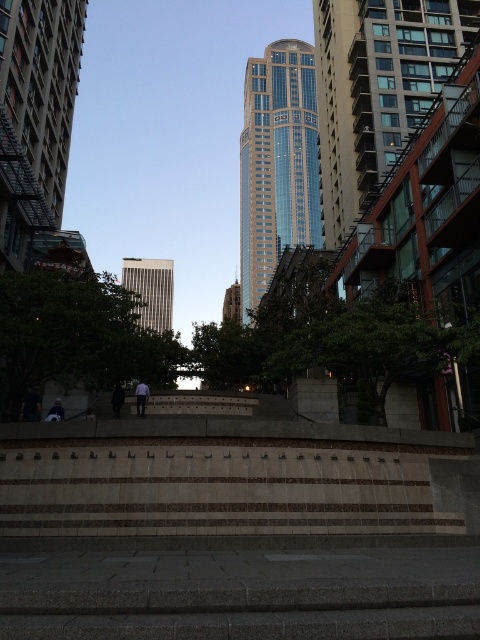
The image size is (480, 640). What do you see at coordinates (231, 304) in the screenshot?
I see `gold glass tower at center` at bounding box center [231, 304].

Who is more distant from viewer, (236, 289) or (115, 410)?

The point (236, 289) is behind.

Who is more distant from viewer, (232, 292) or (122, 403)?

The point (232, 292) is more distant.

Identify the location of gold glass tower at center. (231, 304).

Can you confirm if shiny glass skyscraper at center is positioned to the right of light gray fabric jacket at lower left?

Correct, you'll find shiny glass skyscraper at center to the right of light gray fabric jacket at lower left.

This screenshot has width=480, height=640. What do you see at coordinates (276, 163) in the screenshot? I see `shiny glass skyscraper at center` at bounding box center [276, 163].

The width and height of the screenshot is (480, 640). In order to click on shiny glass skyscraper at center in this screenshot , I will do `click(276, 163)`.

Consider the image. Is glassy steel skyscraper at center to the left of shiny glass skyscraper at center from the viewer's perspective?

No, glassy steel skyscraper at center is not to the left of shiny glass skyscraper at center.

Which is above, glassy steel skyscraper at center or shiny glass skyscraper at center?

shiny glass skyscraper at center is higher up.

What are the coordinates of `glassy steel skyscraper at center` in the screenshot? It's located at (376, 90).